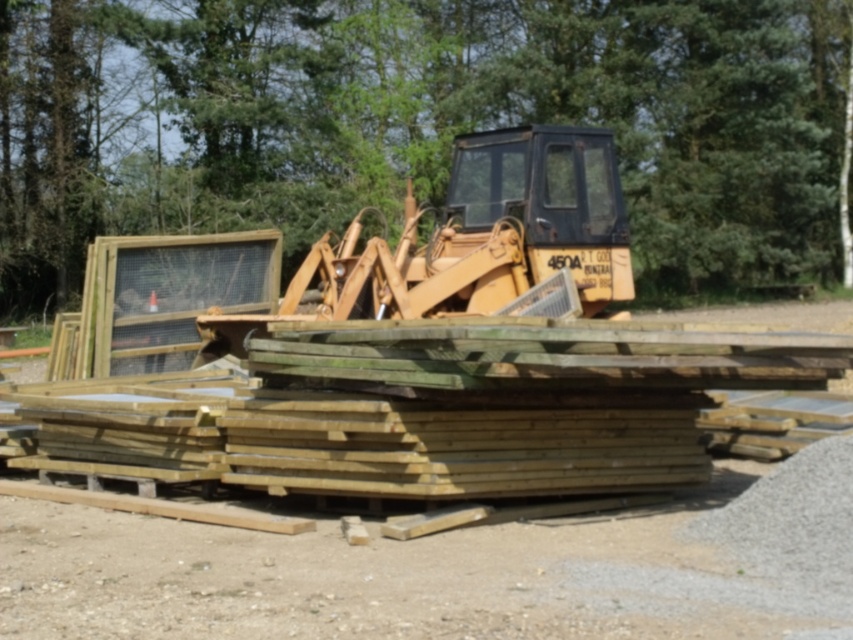
You are a construction worker who needs to determine which object in the scene is bigger between the green leafy tree at upper center and the yellow metallic tractor at center. Which one is bigger?

The green leafy tree at upper center is larger in size than the yellow metallic tractor at center.

You are a construction worker standing at the base of the wooden plank stack. You need to place a new plank between the two points marked as point (347, 99) and point (456, 161). Which point should you place the plank closer to in order to ensure it is closer to the camera?

You should place the plank closer to point (347, 99) because it is further to the camera than point (456, 161).

You are a worker on the construction site and need to move the yellow metallic tractor at center to the left to make space for a new equipment. Which object will the tractor be closer to after moving? Please choose between the green leafy tree at upper center and the wooden planks in the foreground.

The yellow metallic tractor at center, when moved to the left, will be closer to the wooden planks in the foreground because the green leafy tree at upper center is located to the right of the tractor. Moving left would place it nearer to the planks.